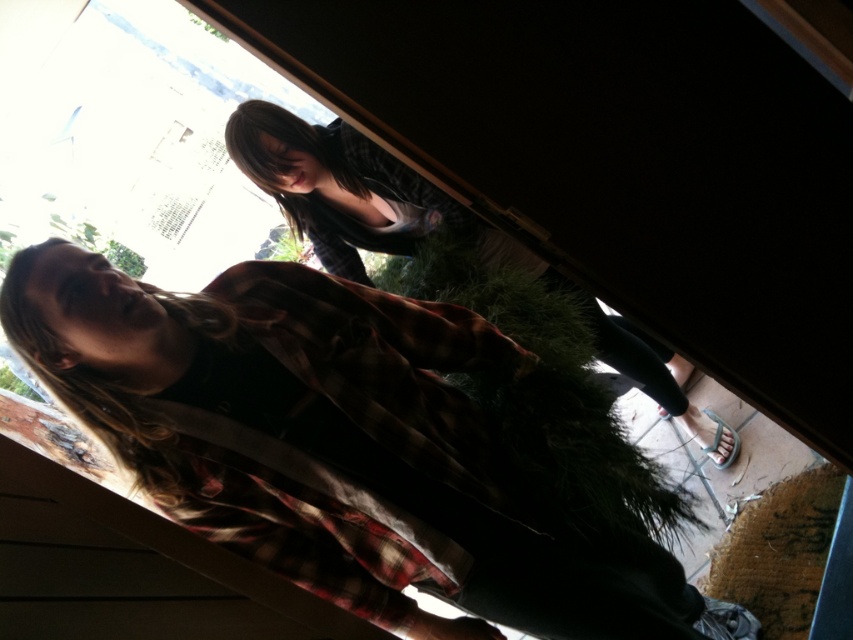
You are standing in the room and want to determine which of the two points, point [405,556] or point [489,250], is closer to you. Based on the scene, which point is nearer?

Point [405,556] is closer to the camera than point [489,250], so the point closer to you is point [405,556].

You are standing in the doorway and need to determine the position of the flannel shirt at center relative to the doorway. Is it closer to the left or right side of the doorway?

The flannel shirt at center is located at point 0.697 on the x and 0.392 on the y, so it is closer to the right side of the doorway.